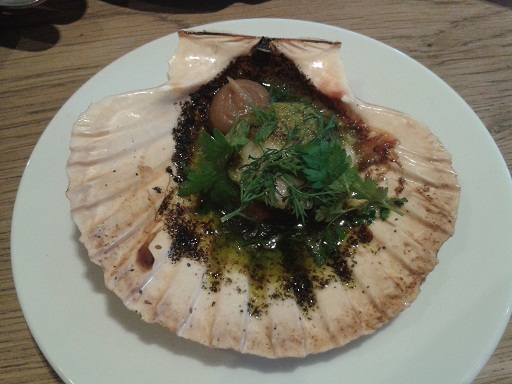
Locate an element on the screen. white plate is located at coordinates (471, 323).